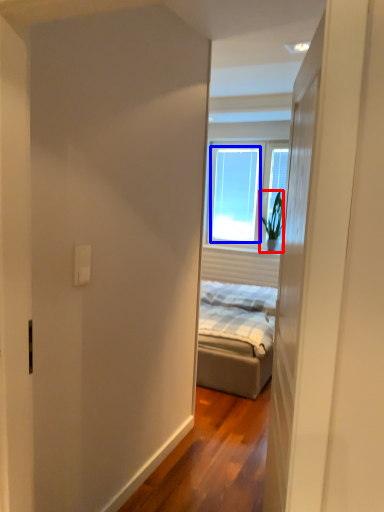
Question: Which object is closer to the camera taking this photo, houseplant (highlighted by a red box) or window (highlighted by a blue box)?

Choices:
 (A) houseplant
 (B) window

Answer: (A)